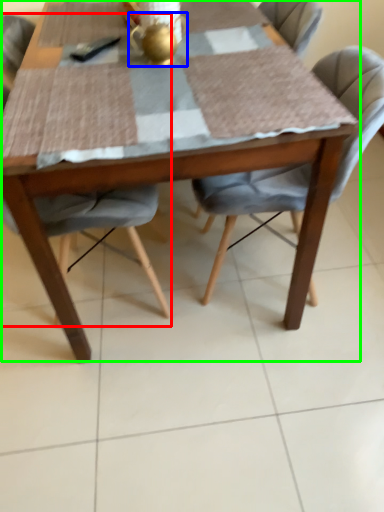
Question: Which is farther away from chair (highlighted by a red box)? tea pot (highlighted by a blue box) or kitchen & dining room table (highlighted by a green box)?

Choices:
 (A) tea pot
 (B) kitchen & dining room table

Answer: (A)